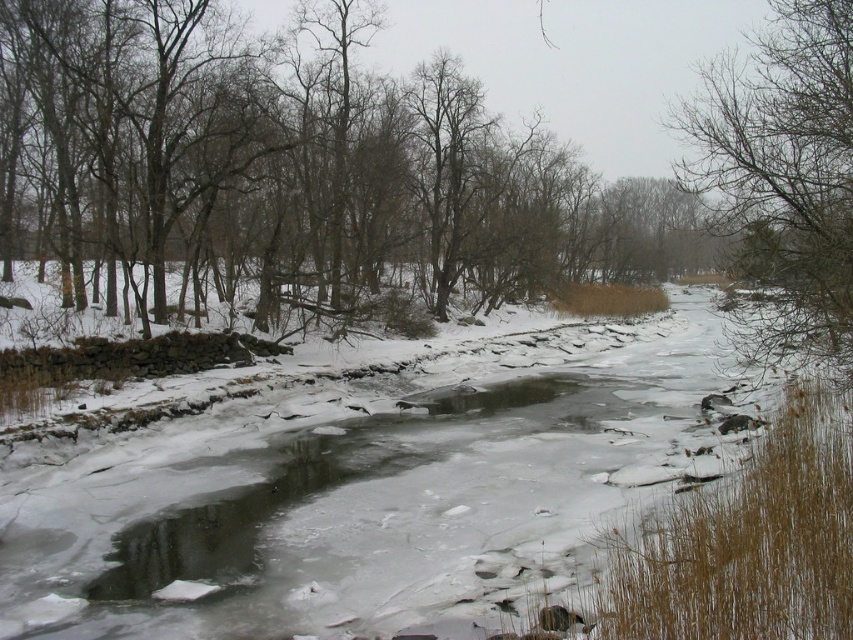
Who is positioned more to the right, brown bark tree at center or bare branches at upper right?

bare branches at upper right is more to the right.

You are a GUI agent. You are given a task and a screenshot of the screen. Output one action in this format:
    pyautogui.click(x=<x>, y=<y>)
    Task: Click on the brown bark tree at center
    
    Given the screenshot: What is the action you would take?
    pyautogui.click(x=293, y=168)

Where is `brown bark tree at center`? Image resolution: width=853 pixels, height=640 pixels. brown bark tree at center is located at coordinates (293, 168).